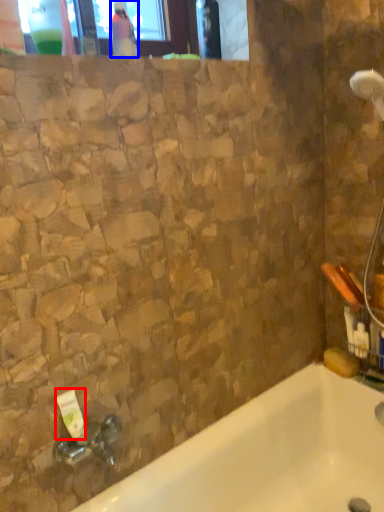
Question: Which of the following is the closest to the observer, toiletry (highlighted by a red box) or bottle (highlighted by a blue box)?

Choices:
 (A) toiletry
 (B) bottle

Answer: (A)